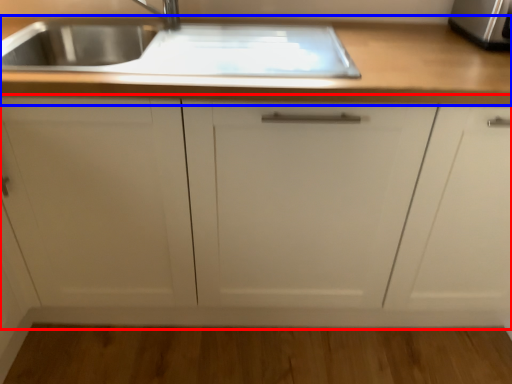
Question: Which of the following is the farthest to the observer, cabinetry (highlighted by a red box) or countertop (highlighted by a blue box)?

Choices:
 (A) cabinetry
 (B) countertop

Answer: (B)